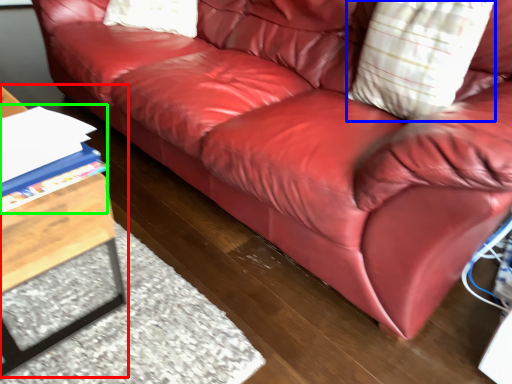
Question: Which is nearer to the table (highlighted by a red box)? throw pillow (highlighted by a blue box) or book (highlighted by a green box).

Choices:
 (A) throw pillow
 (B) book

Answer: (B)